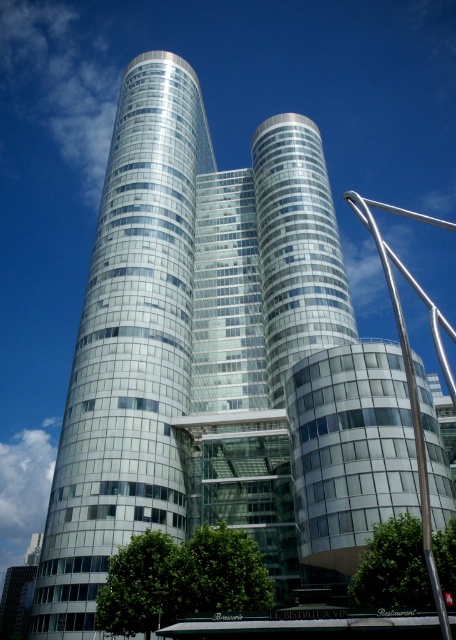
You are a city planner reviewing this architectural design. You notice the glassy silver tower at center and the silver metallic pole at right. Which object would require more space in terms of footprint when constructing them? Please explain your reasoning based on the provided scene.

The silver metallic pole at right requires more space in terms of footprint because it is larger in size compared to the glassy silver tower at center, as stated in the objects description.

You are a city planner assessing the view of the glassy silver tower at center and the silver metallic pole at right. Which object is taller when viewed from the ground level?

The silver metallic pole at right is taller than the glassy silver tower at center.